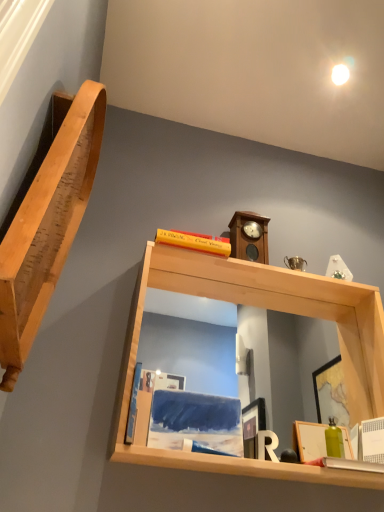
Describe the element at coordinates (265, 308) in the screenshot. The height and width of the screenshot is (512, 384). I see `light wood/matte mirror at upper center, the second shelf from the left` at that location.

The height and width of the screenshot is (512, 384). I want to click on wooden clock at upper center, so click(249, 237).

What do you see at coordinates (133, 405) in the screenshot?
I see `blue matte book at lower left` at bounding box center [133, 405].

This screenshot has height=512, width=384. What do you see at coordinates (48, 223) in the screenshot?
I see `natural wood shelf at left, arranged as the 1th shelf when viewed from the left` at bounding box center [48, 223].

What are the coordinates of `light wood/matte mirror at upper center, arranged as the first shelf when viewed from the right` in the screenshot? It's located at (265, 308).

From a real-world perspective, which is physically below, natural wood shelf at left, placed as the 2th shelf when sorted from right to left, or blue matte book at lower left?

blue matte book at lower left, from a real-world perspective.

Does natural wood shelf at left, arranged as the 1th shelf when viewed from the left, touch blue matte book at lower left?

No.

Relative to blue matte book at lower left, is natural wood shelf at left, placed as the 2th shelf when sorted from right to left, in front or behind?

Visually, natural wood shelf at left, placed as the 2th shelf when sorted from right to left, is located in front of blue matte book at lower left.

Who is smaller, natural wood shelf at left, arranged as the 1th shelf when viewed from the left, or blue matte book at lower left?

blue matte book at lower left is smaller.

In terms of width, does light wood/matte mirror at upper center, the second shelf from the left, look wider or thinner when compared to wooden clock at upper center?

Considering their sizes, light wood/matte mirror at upper center, the second shelf from the left, looks broader than wooden clock at upper center.

In the scene shown: Is there a large distance between light wood/matte mirror at upper center, arranged as the first shelf when viewed from the right, and wooden clock at upper center?

That's not correct — light wood/matte mirror at upper center, arranged as the first shelf when viewed from the right, is a little close to wooden clock at upper center.

Would you say light wood/matte mirror at upper center, arranged as the first shelf when viewed from the right, is inside or outside wooden clock at upper center?

light wood/matte mirror at upper center, arranged as the first shelf when viewed from the right, cannot be found inside wooden clock at upper center.

Which is less distant, [191,263] or [243,244]?

Clearly, point [191,263] is closer to the camera than point [243,244].

Which object is positioned more to the left, matte wooden picture frame at lower right or light wood/matte mirror at upper center, the second shelf from the left?

Positioned to the left is light wood/matte mirror at upper center, the second shelf from the left.

Who is taller, matte wooden picture frame at lower right or light wood/matte mirror at upper center, the second shelf from the left?

Standing taller between the two is light wood/matte mirror at upper center, the second shelf from the left.

From the image's perspective, between matte wooden picture frame at lower right and light wood/matte mirror at upper center, the second shelf from the left, who is located below?

From the image's view, matte wooden picture frame at lower right is below.

Is blue matte book at lower left not close to light wood/matte mirror at upper center, arranged as the first shelf when viewed from the right?

No, blue matte book at lower left is in close proximity to light wood/matte mirror at upper center, arranged as the first shelf when viewed from the right.

From the image's perspective, would you say blue matte book at lower left is shown under light wood/matte mirror at upper center, arranged as the first shelf when viewed from the right?

Yes.

Is blue matte book at lower left looking in the opposite direction of light wood/matte mirror at upper center, the second shelf from the left?

Correct, blue matte book at lower left is looking away from light wood/matte mirror at upper center, the second shelf from the left.

Considering the sizes of blue matte book at lower left and light wood/matte mirror at upper center, the second shelf from the left, in the image, is blue matte book at lower left wider or thinner than light wood/matte mirror at upper center, the second shelf from the left,?

Considering their sizes, blue matte book at lower left looks slimmer than light wood/matte mirror at upper center, the second shelf from the left.

Is wooden clock at upper center thinner than matte wooden picture frame at lower right?

No, wooden clock at upper center is not thinner than matte wooden picture frame at lower right.

Identify the location of picture frame below the wooden clock at upper center (from a real-world perspective). (309, 440).

Based on their positions, is wooden clock at upper center located to the left or right of matte wooden picture frame at lower right?

wooden clock at upper center is positioned on matte wooden picture frame at lower right's left side.

Is the position of wooden clock at upper center more distant than that of matte wooden picture frame at lower right?

Yes, wooden clock at upper center is behind matte wooden picture frame at lower right.

Could you measure the distance between natural wood shelf at left, arranged as the 1th shelf when viewed from the left, and matte wooden picture frame at lower right?

natural wood shelf at left, arranged as the 1th shelf when viewed from the left, is 34.55 inches from matte wooden picture frame at lower right.

From a real-world perspective, is natural wood shelf at left, arranged as the 1th shelf when viewed from the left, on top of matte wooden picture frame at lower right?

Yes.

Is natural wood shelf at left, arranged as the 1th shelf when viewed from the left, with matte wooden picture frame at lower right?

They are not placed beside each other.

Can you confirm if natural wood shelf at left, arranged as the 1th shelf when viewed from the left, is thinner than matte wooden picture frame at lower right?

No, natural wood shelf at left, arranged as the 1th shelf when viewed from the left, is not thinner than matte wooden picture frame at lower right.

Is the surface of blue matte book at lower left in direct contact with matte wooden picture frame at lower right?

blue matte book at lower left is not next to matte wooden picture frame at lower right, and they're not touching.

Could matte wooden picture frame at lower right be considered to be inside blue matte book at lower left?

Definitely not — matte wooden picture frame at lower right is not inside blue matte book at lower left.

Which is closer to the camera, (x=126, y=430) or (x=311, y=457)?

Point (x=126, y=430) is closer to the camera than point (x=311, y=457).

Based on the photo, from a real-world perspective, which object stands above the other?

In real-world perspective, blue matte book at lower left is above.

Identify the location of book that appears below the natural wood shelf at left, arranged as the 1th shelf when viewed from the left (from the image's perspective). This screenshot has width=384, height=512. (133, 405).

Where is `the 2nd shelf directly beneath the wooden clock at upper center (from a real-world perspective)`? the 2nd shelf directly beneath the wooden clock at upper center (from a real-world perspective) is located at coordinates (265, 308).

When comparing their distances from natural wood shelf at left, placed as the 2th shelf when sorted from right to left, does matte wooden picture frame at lower right or blue matte book at lower left seem closer?

blue matte book at lower left is closer to natural wood shelf at left, placed as the 2th shelf when sorted from right to left.

Consider the image. Estimate the real-world distances between objects in this image. Which object is further from natural wood shelf at left, arranged as the 1th shelf when viewed from the left, blue matte book at lower left or light wood/matte mirror at upper center, the second shelf from the left?

blue matte book at lower left lies further to natural wood shelf at left, arranged as the 1th shelf when viewed from the left, than the other object.

Which object lies further to the anchor point matte wooden picture frame at lower right, wooden clock at upper center or blue matte book at lower left?

Among the two, wooden clock at upper center is located further to matte wooden picture frame at lower right.

Based on their spatial positions, is light wood/matte mirror at upper center, the second shelf from the left, or matte wooden picture frame at lower right further from natural wood shelf at left, placed as the 2th shelf when sorted from right to left?

Based on the image, matte wooden picture frame at lower right appears to be further to natural wood shelf at left, placed as the 2th shelf when sorted from right to left.

From the image, which object appears to be nearer to blue matte book at lower left, natural wood shelf at left, arranged as the 1th shelf when viewed from the left, or matte wooden picture frame at lower right?

natural wood shelf at left, arranged as the 1th shelf when viewed from the left, is positioned closer to the anchor blue matte book at lower left.

Looking at the image, which one is located closer to wooden clock at upper center, natural wood shelf at left, arranged as the 1th shelf when viewed from the left, or matte wooden picture frame at lower right?

matte wooden picture frame at lower right.

Looking at the image, which one is located further to natural wood shelf at left, placed as the 2th shelf when sorted from right to left, light wood/matte mirror at upper center, arranged as the first shelf when viewed from the right, or blue matte book at lower left?

blue matte book at lower left.

Based on their spatial positions, is natural wood shelf at left, placed as the 2th shelf when sorted from right to left, or light wood/matte mirror at upper center, arranged as the first shelf when viewed from the right, closer to blue matte book at lower left?

Among the two, light wood/matte mirror at upper center, arranged as the first shelf when viewed from the right, is located nearer to blue matte book at lower left.

I want to click on shelf between blue matte book at lower left and matte wooden picture frame at lower right from left to right, so click(x=265, y=308).

I want to click on book between natural wood shelf at left, arranged as the 1th shelf when viewed from the left, and matte wooden picture frame at lower right, so click(x=133, y=405).

Where is `book between light wood/matte mirror at upper center, the second shelf from the left, and wooden clock at upper center, along the z-axis`? book between light wood/matte mirror at upper center, the second shelf from the left, and wooden clock at upper center, along the z-axis is located at coordinates (133, 405).

Identify the location of picture frame between natural wood shelf at left, arranged as the 1th shelf when viewed from the left, and wooden clock at upper center from front to back. (309, 440).